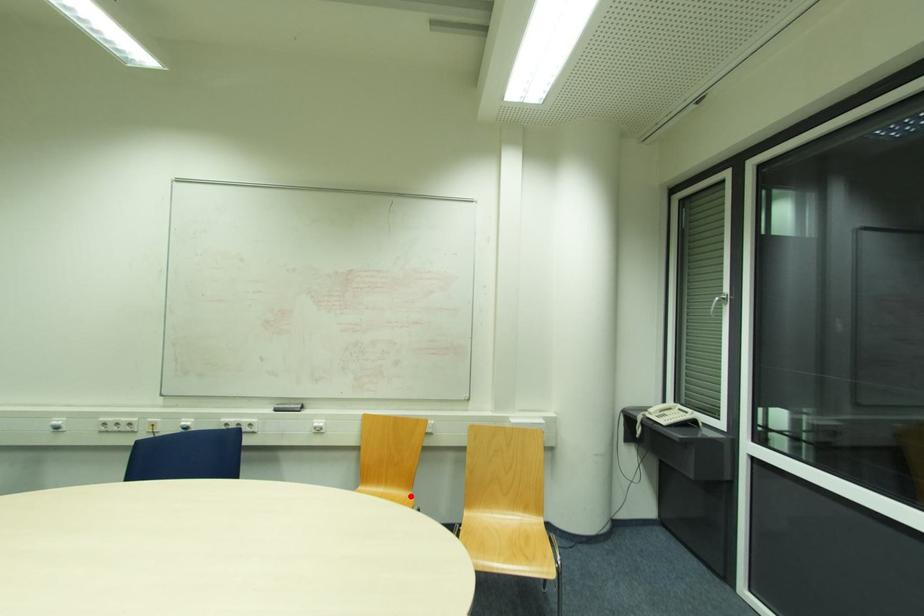
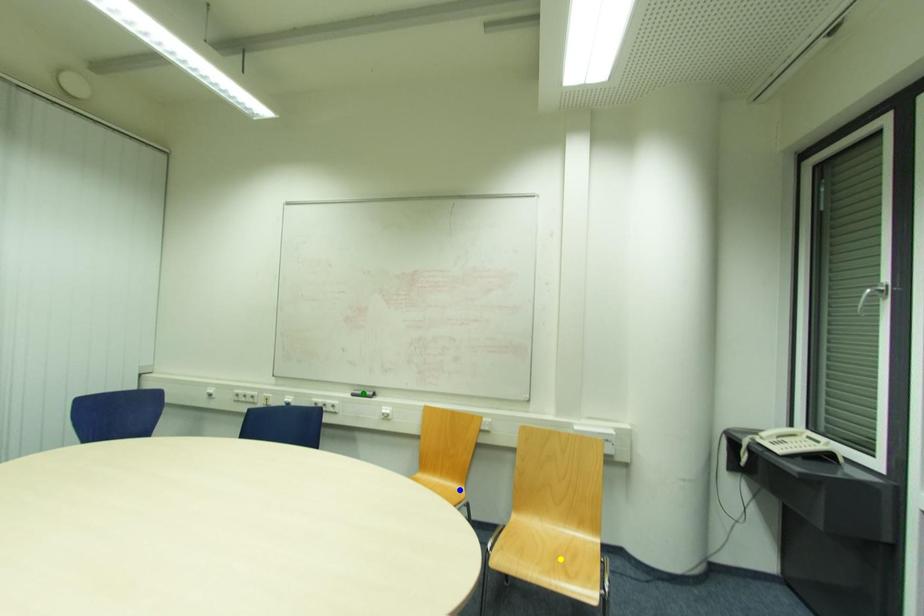
Question: I am providing you with two images of the same scene from different viewpoints. A red point is marked on the first image. You are given multiple points on the second image. Which mark in image 2 goes with the point in image 1?

Choices:
 (A) green point
 (B) yellow point
 (C) blue point

Answer: (C)